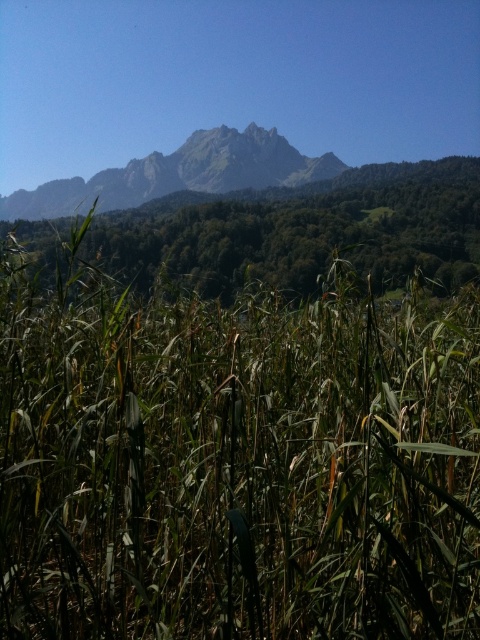
Question: Based on their relative distances, which object is nearer to the green grassy field at center?

Choices:
 (A) green grass at center
 (B) rugged granite mountain range at upper center

Answer: (A)

Question: Which point is closer to the camera?

Choices:
 (A) rugged granite mountain range at upper center
 (B) green grassy field at center
 (C) green grass at center

Answer: (B)

Question: Does green grassy field at center have a smaller size compared to rugged granite mountain range at upper center?

Choices:
 (A) yes
 (B) no

Answer: (A)

Question: Does green grass at center appear under rugged granite mountain range at upper center?

Choices:
 (A) no
 (B) yes

Answer: (B)

Question: Is green grassy field at center to the right of green grass at center from the viewer's perspective?

Choices:
 (A) no
 (B) yes

Answer: (B)

Question: Which of the following is the closest to the observer?

Choices:
 (A) (447, 516)
 (B) (192, 262)
 (C) (300, 154)

Answer: (A)